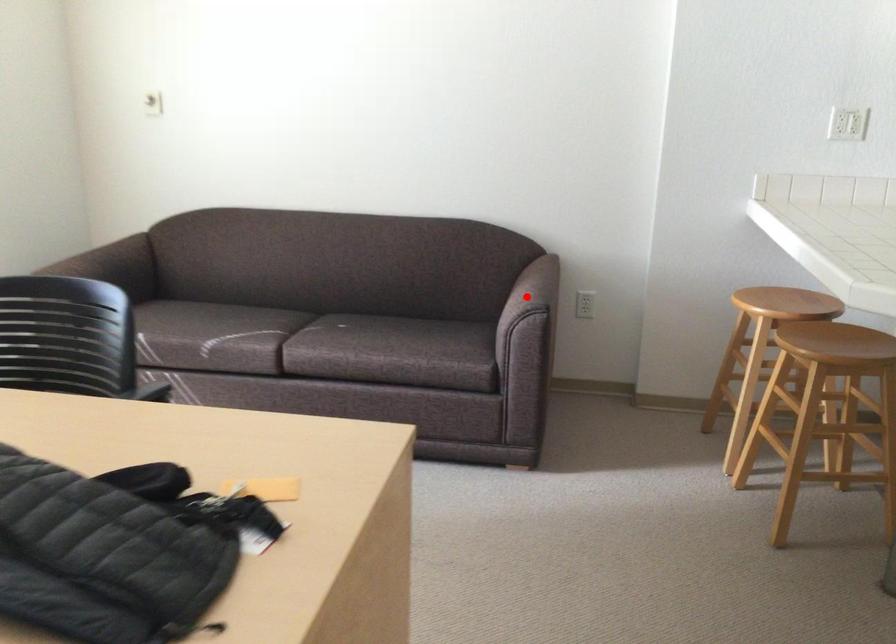
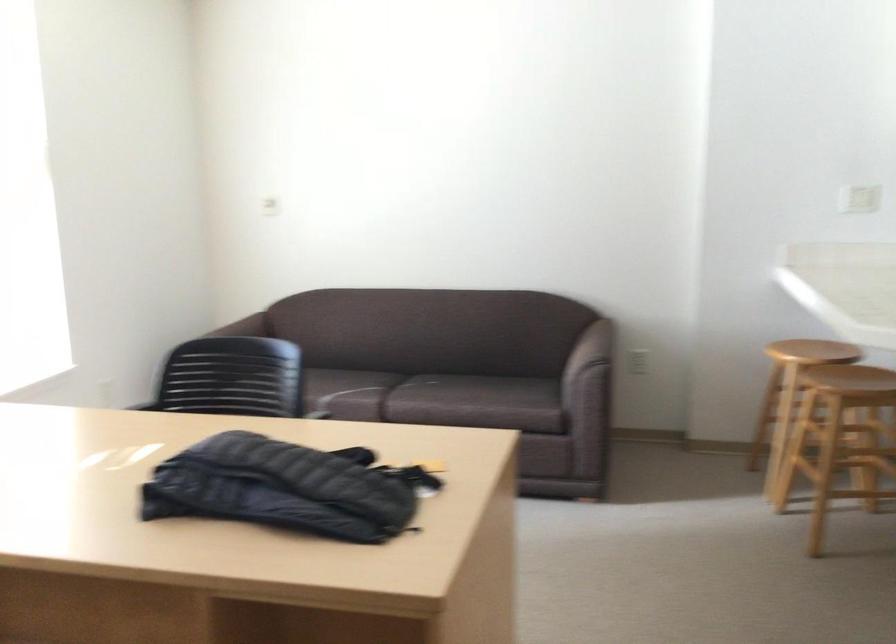
The point at the highlighted location is marked in the first image. Where is the corresponding point in the second image?

(590, 348)